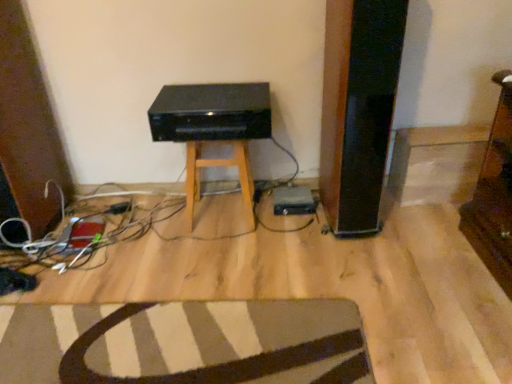
This screenshot has height=384, width=512. What are the coordinates of `free spot behind striped fabric rug at lower center` in the screenshot? It's located at (180, 256).